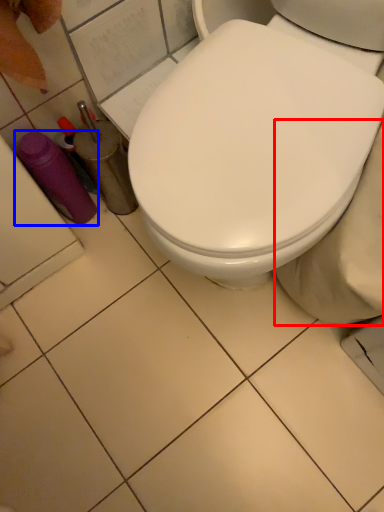
Question: Which of the following is the closest to the observer, bidet (highlighted by a red box) or bottle (highlighted by a blue box)?

Choices:
 (A) bidet
 (B) bottle

Answer: (A)